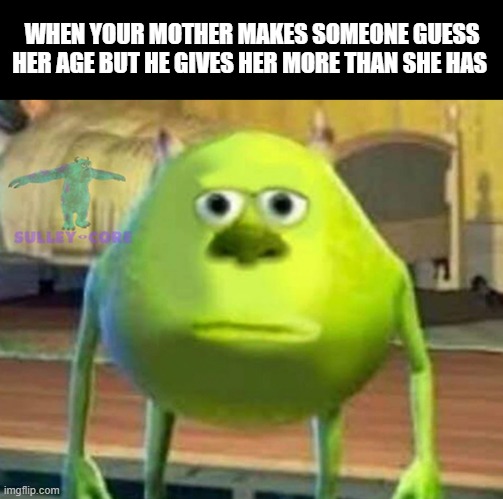
In order to click on bed in this screenshot , I will do `click(118, 194)`.